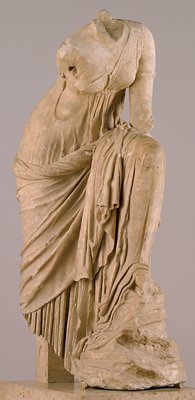
At what (x,y) coordinates should I click in order to perform the action: click on statue. Please return your answer as a coordinate pair (x, y). Looking at the image, I should click on (112, 356).